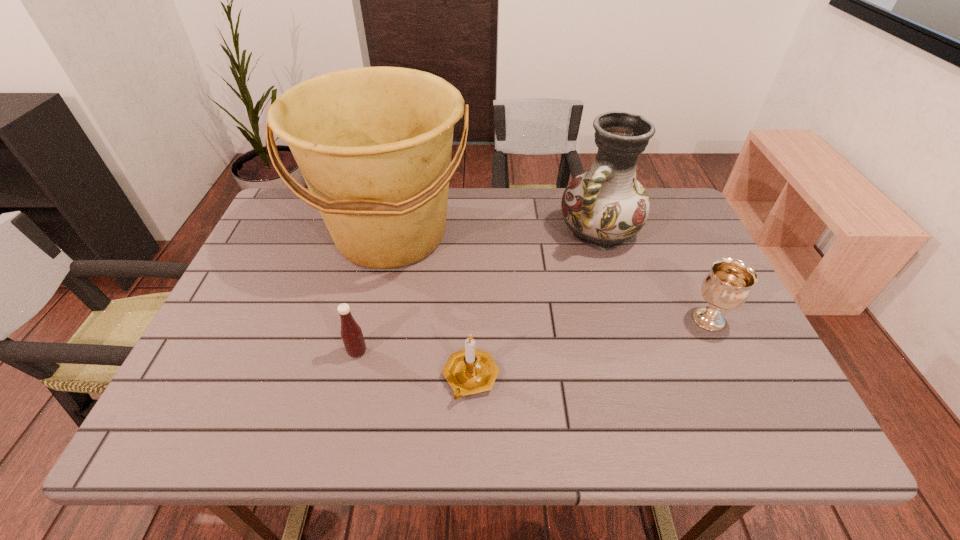
Where is `vacant region located 0.140m on the right of the Tabasco sauce`? vacant region located 0.140m on the right of the Tabasco sauce is located at coordinates coord(429,352).

Identify the location of free region located on the right of the candle holder. coord(574,377).

Where is `bucket that is at the far edge`? This screenshot has height=540, width=960. bucket that is at the far edge is located at coordinates (374, 144).

At what (x,y) coordinates should I click in order to perform the action: click on vase present at the far edge. Please return your answer as a coordinate pair (x, y). This screenshot has height=540, width=960. Looking at the image, I should click on (605, 206).

Locate an element on the screen. This screenshot has height=540, width=960. object present at the near edge is located at coordinates (469, 371).

This screenshot has width=960, height=540. Find the location of `object that is at the left edge`. object that is at the left edge is located at coordinates (374, 144).

You are a GUI agent. You are given a task and a screenshot of the screen. Output one action in this format:
    pyautogui.click(x=<x>, y=<y>)
    Task: Click on the vase that is at the right edge
    
    Given the screenshot: What is the action you would take?
    pyautogui.click(x=605, y=206)

The height and width of the screenshot is (540, 960). Find the location of `chalice positioned at the right edge`. chalice positioned at the right edge is located at coordinates (727, 286).

In order to click on object that is at the far left corner in this screenshot , I will do `click(374, 144)`.

The image size is (960, 540). In order to click on object located in the far right corner section of the desktop in this screenshot , I will do `click(605, 206)`.